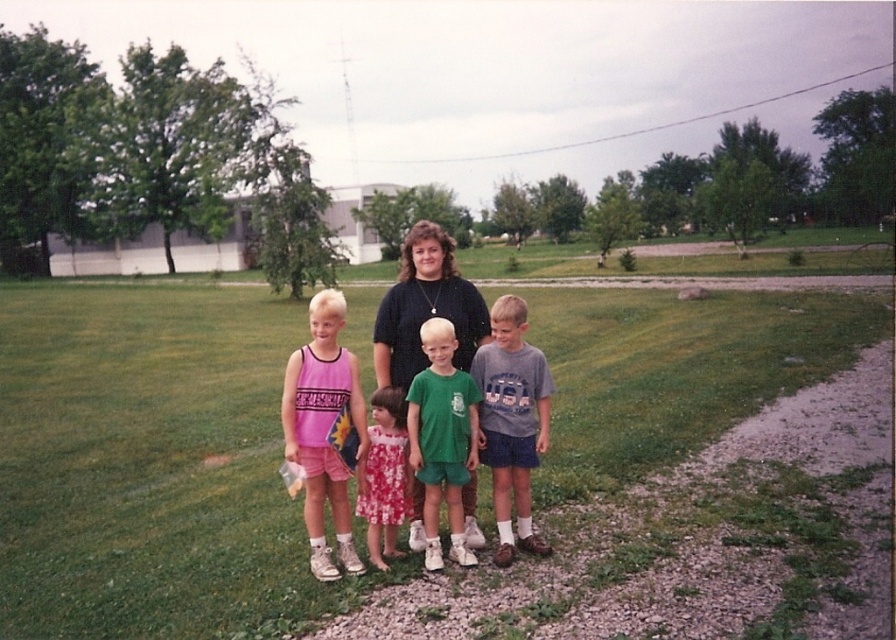
Question: Can you confirm if matte black shirt at center is smaller than floral cotton dress at center?

Choices:
 (A) yes
 (B) no

Answer: (B)

Question: Based on their relative distances, which object is nearer to the gray cotton t-shirt at center?

Choices:
 (A) green grass at center
 (B) green matte shirt at center

Answer: (B)

Question: Can you confirm if gray cotton t-shirt at center is positioned above floral cotton dress at center?

Choices:
 (A) yes
 (B) no

Answer: (A)

Question: Which object is farther from the camera taking this photo?

Choices:
 (A) green matte shirt at center
 (B) floral cotton dress at center

Answer: (B)

Question: Can you confirm if pink jersey at left is thinner than green matte shirt at center?

Choices:
 (A) yes
 (B) no

Answer: (A)

Question: Considering the real-world distances, which object is farthest from the green grass at center?

Choices:
 (A) pink jersey at left
 (B) black matte shirt at center

Answer: (A)